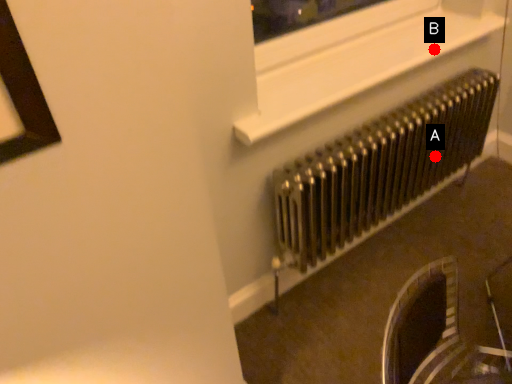
Question: Two points are circled on the image, labeled by A and B beside each circle. Which point appears closest to the camera in this image?

Choices:
 (A) A is closer
 (B) B is closer

Answer: (B)